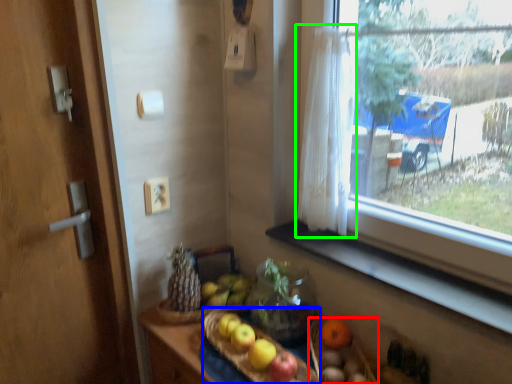
Question: Which object is the closest to the basket (highlighted by a red box)? Choose among these: basket (highlighted by a blue box) or curtain (highlighted by a green box).

Choices:
 (A) basket
 (B) curtain

Answer: (A)